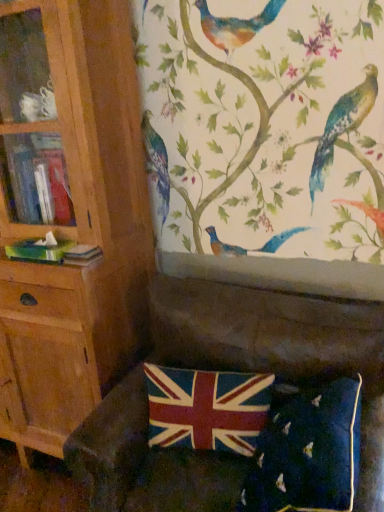
Question: Considering the relative sizes of velvet dark green couch at lower center and wooden bookcase at left in the image provided, is velvet dark green couch at lower center smaller than wooden bookcase at left?

Choices:
 (A) yes
 (B) no

Answer: (A)

Question: Is velvet dark green couch at lower center taller than wooden bookcase at left?

Choices:
 (A) yes
 (B) no

Answer: (B)

Question: Is velvet dark green couch at lower center far away from wooden bookcase at left?

Choices:
 (A) yes
 (B) no

Answer: (B)

Question: Is velvet dark green couch at lower center to the right of wooden bookcase at left from the viewer's perspective?

Choices:
 (A) no
 (B) yes

Answer: (B)

Question: From the image's perspective, is velvet dark green couch at lower center beneath wooden bookcase at left?

Choices:
 (A) no
 (B) yes

Answer: (B)

Question: In the image, is wooden bookcase at left on the left side or the right side of velvet dark green couch at lower center?

Choices:
 (A) right
 (B) left

Answer: (B)

Question: Do you think wooden bookcase at left is within velvet dark green couch at lower center, or outside of it?

Choices:
 (A) outside
 (B) inside

Answer: (A)

Question: In terms of height, does wooden bookcase at left look taller or shorter compared to velvet dark green couch at lower center?

Choices:
 (A) short
 (B) tall

Answer: (B)

Question: Is wooden bookcase at left wider or thinner than velvet dark green couch at lower center?

Choices:
 (A) wide
 (B) thin

Answer: (B)

Question: Considering the positions of velvet dark green couch at lower center and wooden bookcase at left in the image, is velvet dark green couch at lower center wider or thinner than wooden bookcase at left?

Choices:
 (A) wide
 (B) thin

Answer: (A)

Question: Considering the positions of point (233, 484) and point (109, 44), is point (233, 484) closer or farther from the camera than point (109, 44)?

Choices:
 (A) farther
 (B) closer

Answer: (B)

Question: From a real-world perspective, is velvet dark green couch at lower center physically located above or below wooden bookcase at left?

Choices:
 (A) above
 (B) below

Answer: (B)

Question: From the image's perspective, relative to wooden bookcase at left, is velvet dark green couch at lower center above or below?

Choices:
 (A) below
 (B) above

Answer: (A)

Question: In the image, is velvet union jack pillow at lower center positioned in front of or behind velvet dark green couch at lower center?

Choices:
 (A) behind
 (B) front

Answer: (A)

Question: Looking at the image, does velvet union jack pillow at lower center seem bigger or smaller compared to velvet dark green couch at lower center?

Choices:
 (A) big
 (B) small

Answer: (B)